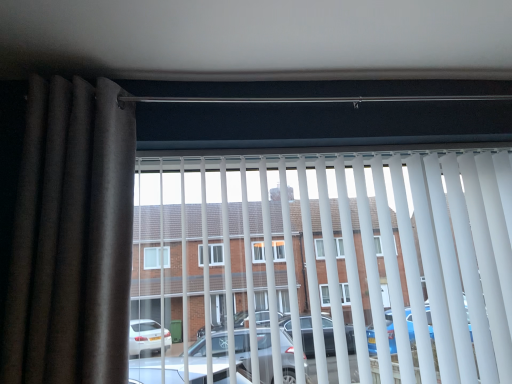
This screenshot has height=384, width=512. Describe the element at coordinates (72, 237) in the screenshot. I see `brown fabric curtain at left` at that location.

What is the approximate width of brown fabric curtain at left?

It is 8.91 inches.

Where is `brown fabric curtain at left`? The height and width of the screenshot is (384, 512). brown fabric curtain at left is located at coordinates (72, 237).

What are the coordinates of `white plastic blinds at center` in the screenshot? It's located at (345, 251).

The height and width of the screenshot is (384, 512). Describe the element at coordinates (345, 251) in the screenshot. I see `white plastic blinds at center` at that location.

Identify the location of brown fabric curtain at left. (72, 237).

Which is more to the left, brown fabric curtain at left or white plastic blinds at center?

brown fabric curtain at left.

Between brown fabric curtain at left and white plastic blinds at center, which one is positioned in front?

brown fabric curtain at left.

Is point (73, 262) behind point (433, 172)?

That is False.

From the image's perspective, between brown fabric curtain at left and white plastic blinds at center, which one is located above?

From the image's view, brown fabric curtain at left is above.

From a real-world perspective, who is located lower, brown fabric curtain at left or white plastic blinds at center?

From a 3D spatial view, white plastic blinds at center is below.

Consider the image. Does brown fabric curtain at left have a lesser width compared to white plastic blinds at center?

Incorrect, the width of brown fabric curtain at left is not less than that of white plastic blinds at center.

Is brown fabric curtain at left taller than white plastic blinds at center?

Indeed, brown fabric curtain at left has a greater height compared to white plastic blinds at center.

Looking at this image, looking at the image, does brown fabric curtain at left seem bigger or smaller compared to white plastic blinds at center?

Considering their sizes, brown fabric curtain at left takes up less space than white plastic blinds at center.

In the scene shown: Is white plastic blinds at center surrounded by brown fabric curtain at left?

That's incorrect, white plastic blinds at center is not inside brown fabric curtain at left.

Is brown fabric curtain at left touching white plastic blinds at center?

No, brown fabric curtain at left is not making contact with white plastic blinds at center.

Is brown fabric curtain at left facing away from white plastic blinds at center?

No, brown fabric curtain at left's orientation is not away from white plastic blinds at center.

What's the angular difference between brown fabric curtain at left and white plastic blinds at center's facing directions?

There is a 0.00342-degree angle between the facing directions of brown fabric curtain at left and white plastic blinds at center.

How distant is brown fabric curtain at left from white plastic blinds at center?

brown fabric curtain at left and white plastic blinds at center are 24.15 inches apart from each other.

This screenshot has width=512, height=384. What are the coordinates of `window blind on the right of brown fabric curtain at left` in the screenshot? It's located at (345, 251).

Is white plastic blinds at center to the left or to the right of brown fabric curtain at left in the image?

In the image, white plastic blinds at center appears on the right side of brown fabric curtain at left.

Does white plastic blinds at center lie behind brown fabric curtain at left?

Yes, it is behind brown fabric curtain at left.

Does point (198, 213) lie behind point (124, 147)?

Yes, point (198, 213) is farther from viewer.

From the image's perspective, which one is positioned lower, white plastic blinds at center or brown fabric curtain at left?

From the image's view, white plastic blinds at center is below.

From a real-world perspective, is white plastic blinds at center positioned over brown fabric curtain at left based on gravity?

Actually, white plastic blinds at center is physically below brown fabric curtain at left in the real world.

From the picture: Looking at their sizes, would you say white plastic blinds at center is wider or thinner than brown fabric curtain at left?

In the image, white plastic blinds at center appears to be more narrow than brown fabric curtain at left.

Based on the photo, can you confirm if white plastic blinds at center is taller than brown fabric curtain at left?

Incorrect, the height of white plastic blinds at center is not larger of that of brown fabric curtain at left.

Does white plastic blinds at center have a larger size compared to brown fabric curtain at left?

Yes.

Looking at this image, can we say white plastic blinds at center lies outside brown fabric curtain at left?

Yes.

Is white plastic blinds at center beside brown fabric curtain at left?

No, white plastic blinds at center is not beside brown fabric curtain at left.

Is white plastic blinds at center positioned with its back to brown fabric curtain at left?

white plastic blinds at center is not turned away from brown fabric curtain at left.

The image size is (512, 384). I want to click on curtain that is above the white plastic blinds at center (from a real-world perspective), so click(x=72, y=237).

The height and width of the screenshot is (384, 512). In order to click on curtain lying above the white plastic blinds at center (from the image's perspective) in this screenshot , I will do (x=72, y=237).

Find the location of a particular element. The width and height of the screenshot is (512, 384). curtain above the white plastic blinds at center (from a real-world perspective) is located at coordinates (72, 237).